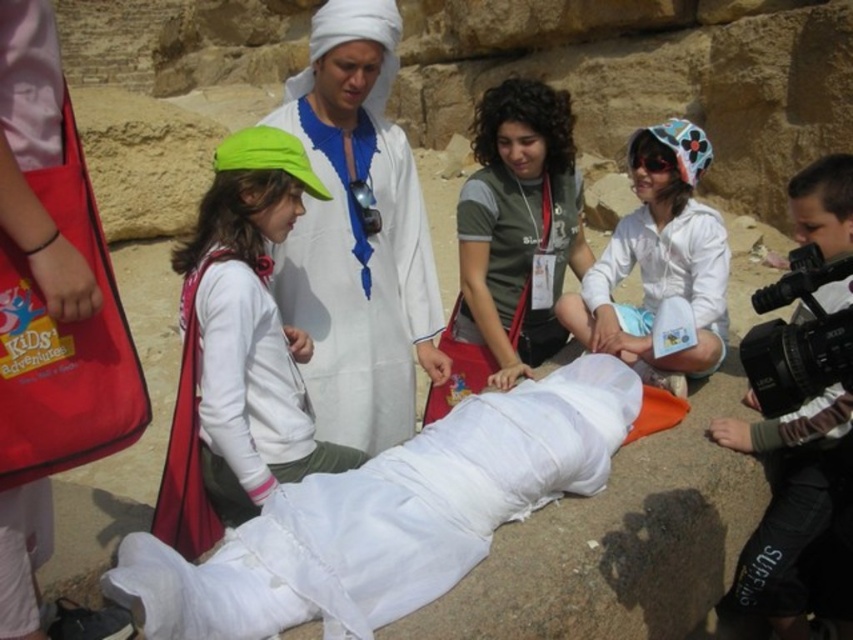
You are a visitor at an archaeological site and you see the white cotton cloth at center and the white cotton robe at center. You want to touch both items but you can only move 10 meters. Can you reach both items without moving more than 10 meters?

The white cotton cloth at center and white cotton robe at center are 10.35 meters apart. Since the distance between them is greater than 10 meters, you cannot reach both items without exceeding the 10 meter limit.

You are a photographer trying to capture a clear shot of both the white cotton cloth at center and the white cotton robe at center. Since they are both white, you want to adjust your camera settings to ensure the bigger object stands out. Which object should you focus on to make sure it appears larger in the photo?

The white cotton cloth at center is bigger than the white cotton robe at center, so focusing on the white cotton cloth at center will ensure it appears larger in the photo.

Looking at this image, you are an archaeologist examining the scene. You need to locate the green fabric cap at upper left. Where exactly is it positioned in the image?

The green fabric cap at upper left is located at the 2D coordinates point (251, 326) in the image.